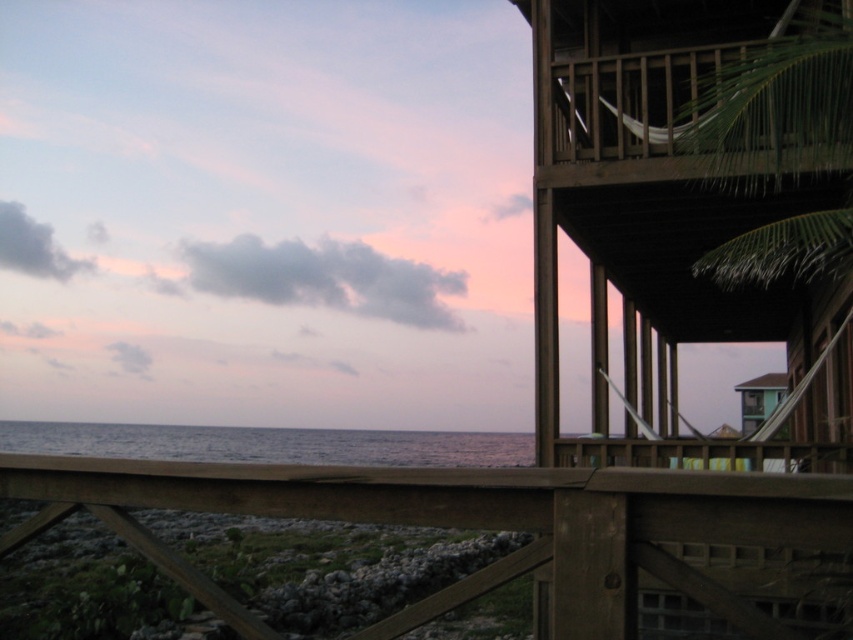
Question: Is brown wooden balcony at upper right positioned before brown wooden deck at lower center?

Choices:
 (A) no
 (B) yes

Answer: (A)

Question: Which point is farther to the camera?

Choices:
 (A) (805, 353)
 (B) (485, 566)
 (C) (757, 244)

Answer: (B)

Question: Can you confirm if brown wooden balcony at upper right is positioned to the left of green leafy palm tree at upper right?

Choices:
 (A) yes
 (B) no

Answer: (B)

Question: Which object is closer to the camera taking this photo?

Choices:
 (A) green leafy palm tree at upper right
 (B) brown wooden balcony at upper right
 (C) brown wooden deck at lower center

Answer: (C)

Question: Which of the following is the closest to the observer?

Choices:
 (A) green leafy palm tree at upper right
 (B) brown wooden balcony at upper right

Answer: (A)

Question: Does brown wooden balcony at upper right appear on the right side of brown wooden deck at lower center?

Choices:
 (A) yes
 (B) no

Answer: (A)